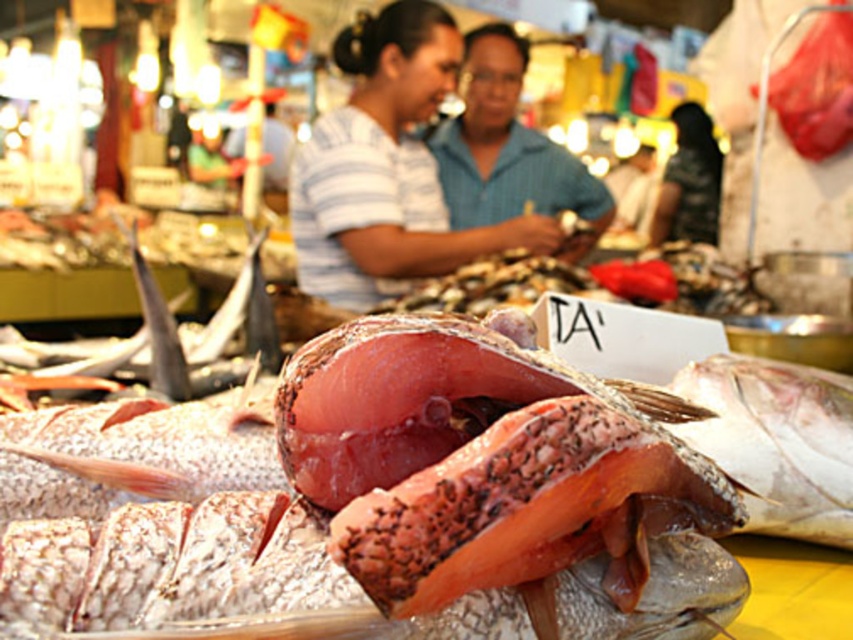
Question: Which point appears closest to the camera in this image?

Choices:
 (A) (595, 211)
 (B) (418, 264)
 (C) (779, 376)

Answer: (C)

Question: Which point is farther to the camera?

Choices:
 (A) (367, 61)
 (B) (590, 212)

Answer: (B)

Question: Which of the following is the farthest from the observer?

Choices:
 (A) blue striped shirt at center
 (B) shiny silver fish at center

Answer: (A)

Question: Can you confirm if matte striped shirt at center is bigger than shiny silver fish at center?

Choices:
 (A) yes
 (B) no

Answer: (A)

Question: Does shiny silver fish at center appear over blue striped shirt at center?

Choices:
 (A) no
 (B) yes

Answer: (A)

Question: Is matte striped shirt at center bigger than shiny silver fish at center?

Choices:
 (A) no
 (B) yes

Answer: (B)